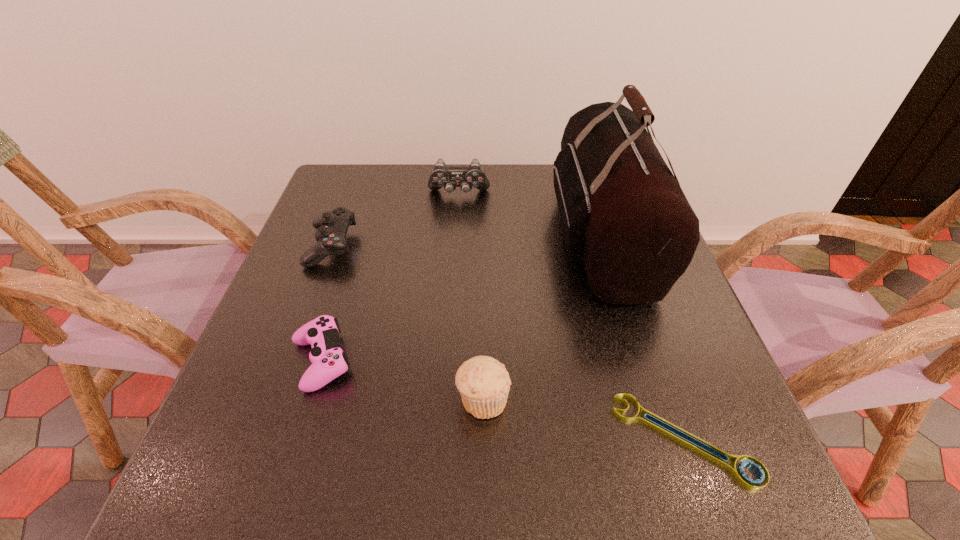
The height and width of the screenshot is (540, 960). I want to click on the third closest control to the tallest object, so coord(332,226).

Locate an element on the screen. control object that ranks as the third closest to the muffin is located at coordinates [449, 177].

I want to click on vacant space that satisfies the following two spatial constraints: 1. on the surface of the shortest object with buttons; 2. on the right side of the tallest control, so click(x=444, y=439).

Locate an element on the screen. The height and width of the screenshot is (540, 960). free space that satisfies the following two spatial constraints: 1. on the front pocket of the duffel bag; 2. on the right side of the wrench is located at coordinates (664, 439).